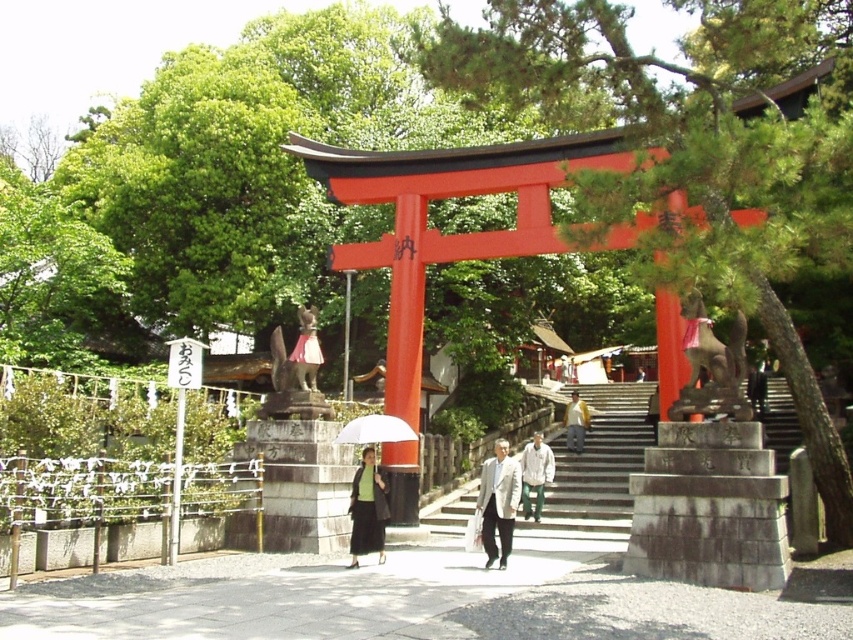
You are a photographer taking a photo of the traditional Japanese torii gate. You notice a person wearing a light gray fabric jacket at center and a matte pink skirt at center walking towards the camera. Which clothing item appears narrower in the photo?

The light gray fabric jacket at center appears narrower than the matte pink skirt at center in the photo.

You are a photographer standing at the base of the torii gate. You want to capture a photo of both the light beige suit at center and the matte green skirt at center. Which object should you zoom in on to ensure both are fully visible in the frame?

You should zoom in on the matte green skirt at center because its smaller width allows both objects to fit within the frame while keeping the light beige suit at center visible.

You are standing at the base of the torii gate and want to reach the point marked at coordinates point (479, 484). If your walking speed is 3 feet per second, how many seconds will it take you to reach that point?

The distance to point (479, 484) is 87.33 feet. At a speed of 3 feet per second, dividing 87.33 by 3 gives approximately 29.11 seconds. So, it will take about 29 seconds to reach the point.